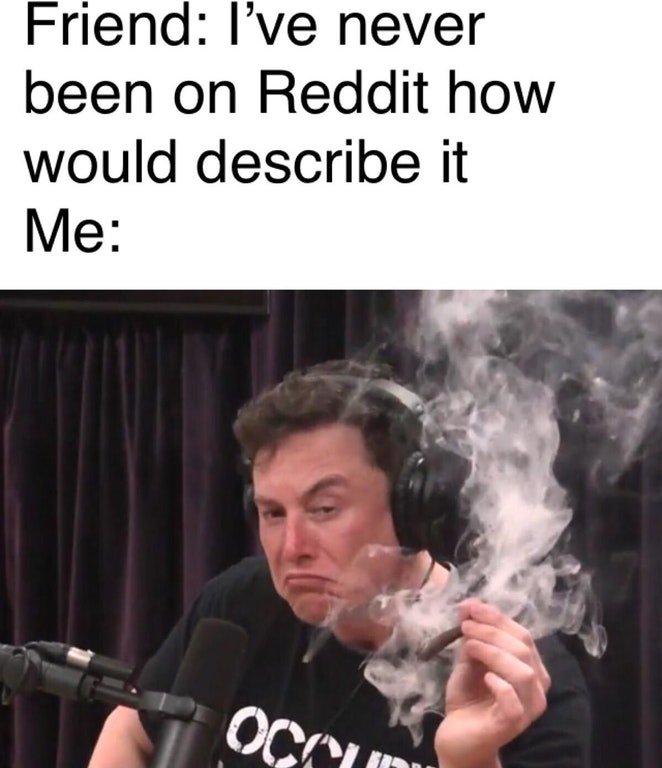
I want to click on black headphones, so (432, 495).